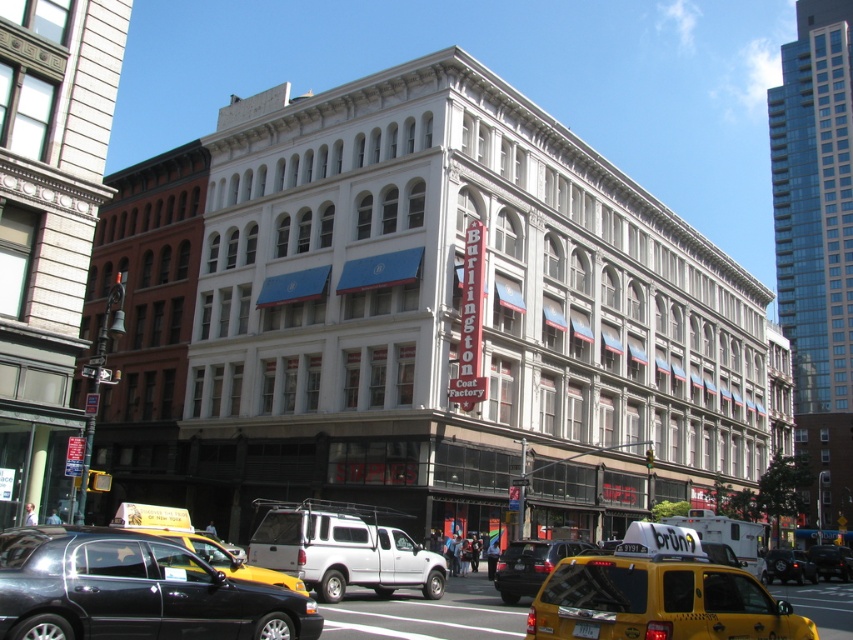
You are standing at the intersection in front of the historic building. You notice two points marked on the ground, one at coordinate point(84, 627) and the other at point(821, 560). Which point is closer to your current position?

The point at coordinate point(84, 627) is closer to your current position because it is closer to the camera than point(821, 560).

You are a pedestrian waiting to cross the street. You see a black glossy sedan at lower left and a metallic silver van at center. Which vehicle should you avoid stepping in front of while crossing?

You should avoid stepping in front of the metallic silver van at center because the black glossy sedan at lower left is to the left of it, meaning the van is further along the street and closer to your crossing path.

You are a pedestrian standing at the crosswalk in front of the historic building. You need to cross the street and reach the yellow rubber taxi at lower right. However, there is a black glossy sedan at lower left blocking your path. Can you walk around it to reach the taxi?

The black glossy sedan at lower left is smaller than the yellow rubber taxi at lower right. Since the sedan is smaller, it is easier to walk around it to reach the yellow rubber taxi at lower right.